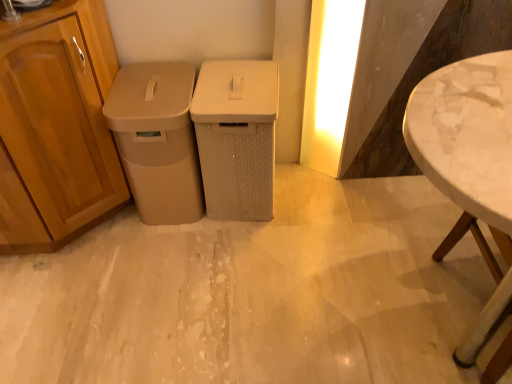
The height and width of the screenshot is (384, 512). Identify the location of vacant area that is situated to the right of beige textured waste bin at center, positioned as the 1th waste container in right-to-left order. (313, 197).